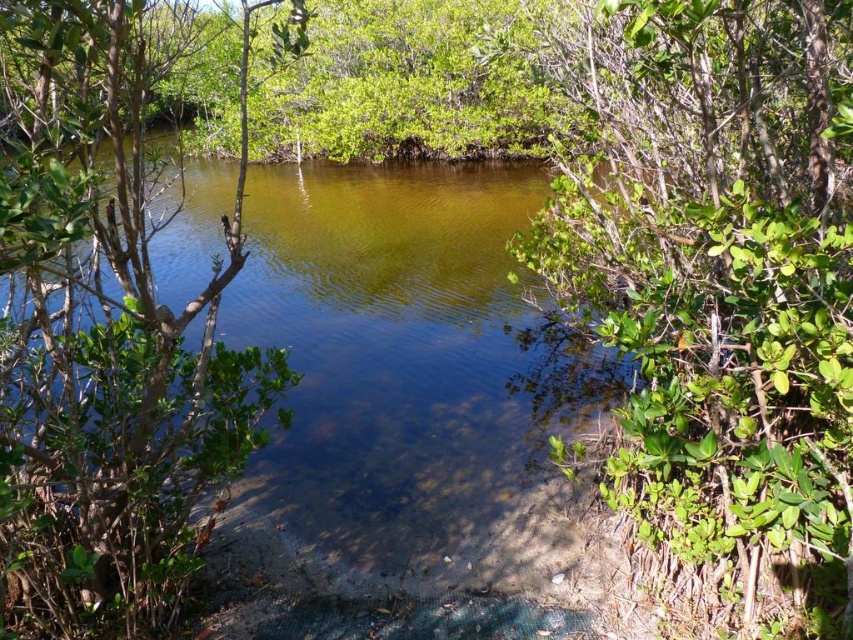
Is clear water at center below green leafy tree at left?

Actually, clear water at center is above green leafy tree at left.

What do you see at coordinates (410, 388) in the screenshot?
I see `clear water at center` at bounding box center [410, 388].

Measure the distance between point [483,212] and camera.

Point [483,212] is 38.10 feet away from camera.

Find the location of `clear water at center`. clear water at center is located at coordinates (410, 388).

Based on the photo, is green leafy bush at center shorter than clear water at center?

Correct, green leafy bush at center is not as tall as clear water at center.

Which is in front, point (825, 264) or point (247, 316)?

Point (825, 264)

Where is `green leafy bush at center`? Image resolution: width=853 pixels, height=640 pixels. green leafy bush at center is located at coordinates (709, 259).

Can you confirm if green leafy bush at center is smaller than green leafy tree at left?

Yes.

Who is positioned more to the left, green leafy bush at center or green leafy tree at left?

From the viewer's perspective, green leafy tree at left appears more on the left side.

Is point (781, 528) positioned behind point (9, 513)?

Yes, point (781, 528) is farther from viewer.

You are a GUI agent. You are given a task and a screenshot of the screen. Output one action in this format:
    pyautogui.click(x=<x>, y=<y>)
    Task: Click on the green leafy bush at center
    This screenshot has height=640, width=853.
    Given the screenshot: What is the action you would take?
    pyautogui.click(x=709, y=259)